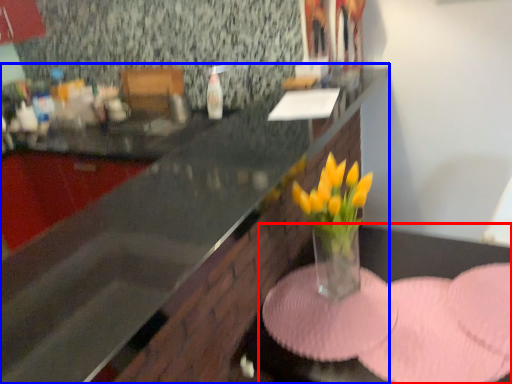
Question: Which object is further to the camera taking this photo, table (highlighted by a red box) or countertop (highlighted by a blue box)?

Choices:
 (A) table
 (B) countertop

Answer: (A)